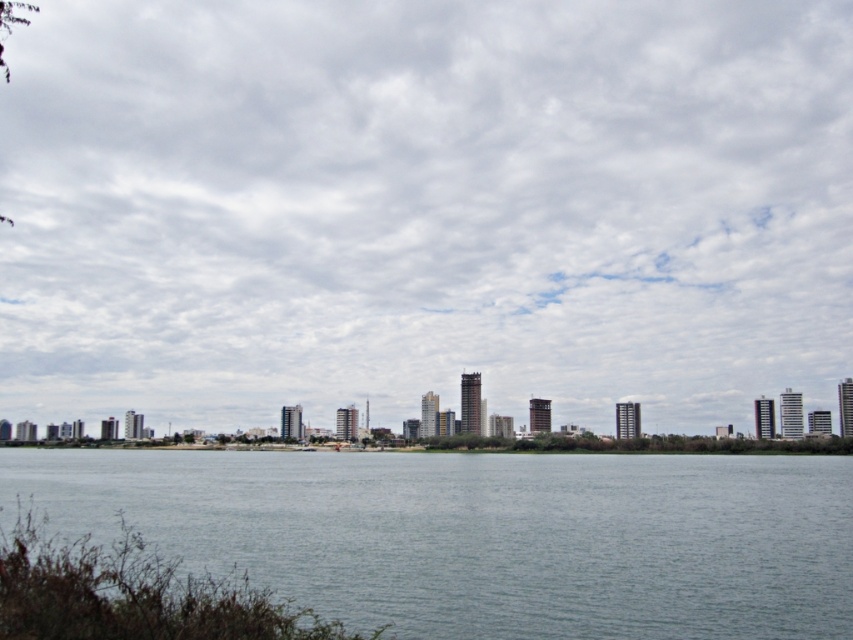
You are an architect designing a new building in the city. You want to ensure that the building doesn not block the view of the cloudy sky at upper center from the green leafy shrub at lower left. Based on the scene description, is this possible?

The green leafy shrub at lower left is behind the cloudy sky at upper center, meaning the sky is closer to the viewer than the shrub. Since the shrub is behind the sky, it cannot block the view of the sky from its position. Therefore, the new building would not need to worry about blocking the view of the cloudy sky at upper center from the green leafy shrub at lower left.

You are a drone operator who needs to fly a drone from the cloudy sky at upper center to the green leafy shrub at lower left. What is the approximate distance the drone needs to cover?

The cloudy sky at upper center is 350.56 meters away from the green leafy shrub at lower left, so the drone needs to cover approximately 350.56 meters.

You are a photographer planning to capture the entire cityscape in the background. However, you notice the gray water at center and the green leafy shrub at lower left might obstruct your view. Which of these two objects is larger and could potentially block more of the city skyline?

The gray water at center is larger in size than the green leafy shrub at lower left, so it could potentially block more of the city skyline.